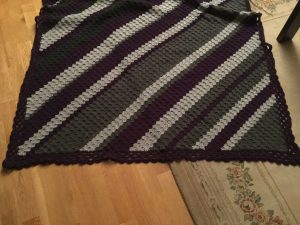
Identify the location of wood floor. (53, 192), (11, 43).